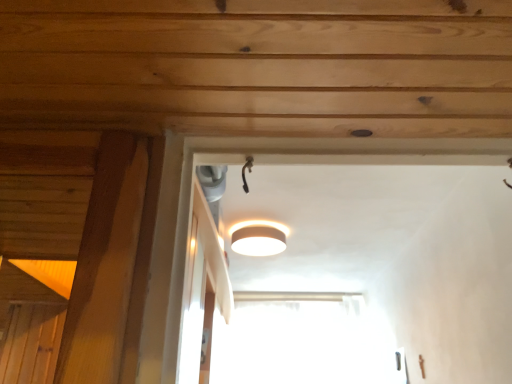
Question: In the image, is white matte lamp at upper center positioned in front of or behind transparent glass window at center?

Choices:
 (A) behind
 (B) front

Answer: (B)

Question: Is point (279, 235) positioned closer to the camera than point (373, 370)?

Choices:
 (A) closer
 (B) farther

Answer: (A)

Question: From the image's perspective, is white matte lamp at upper center above or below transparent glass window at center?

Choices:
 (A) above
 (B) below

Answer: (A)

Question: Looking at their shapes, would you say transparent glass window at center is wider or thinner than white matte lamp at upper center?

Choices:
 (A) thin
 (B) wide

Answer: (A)

Question: Looking at the image, does transparent glass window at center seem bigger or smaller compared to white matte lamp at upper center?

Choices:
 (A) big
 (B) small

Answer: (A)

Question: Considering the positions of transparent glass window at center and white matte lamp at upper center in the image, is transparent glass window at center taller or shorter than white matte lamp at upper center?

Choices:
 (A) short
 (B) tall

Answer: (B)

Question: From a real-world perspective, is transparent glass window at center above or below white matte lamp at upper center?

Choices:
 (A) below
 (B) above

Answer: (A)